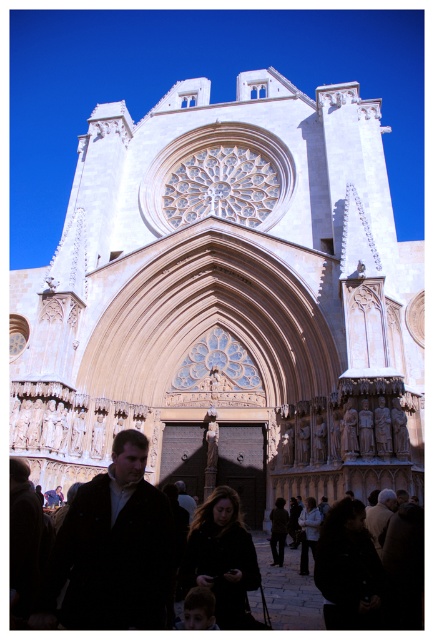
You are a photographer planning to capture the beige stone church at center and the black fabric crowd at lower center in a single shot. Based on their relative sizes in the image, which object should appear larger in your photograph?

The beige stone church at center appears larger because it is taller than the black fabric crowd at lower center.

You are standing in front of the cathedral and want to reach a specific point marked at coordinates point (144, 488). If your current position is 50 feet away from the cathedral, can you walk straight ahead to reach that point without moving sideways?

The distance of point (144, 488) from viewer is 101.09 feet. Since you are currently 50 feet away from the cathedral, walking straight ahead would take you to the cathedral itself, but the point is 101.09 feet away from your current position. Therefore, you need to move forward approximately 51.09 feet beyond the cathedral structure, which may not be possible if the cathedral blocks your path.